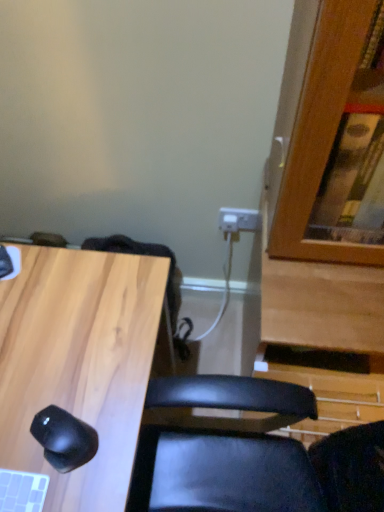
This screenshot has height=512, width=384. Find the location of `vacant space to the right of black matte mouse at lower left`. vacant space to the right of black matte mouse at lower left is located at coordinates (116, 431).